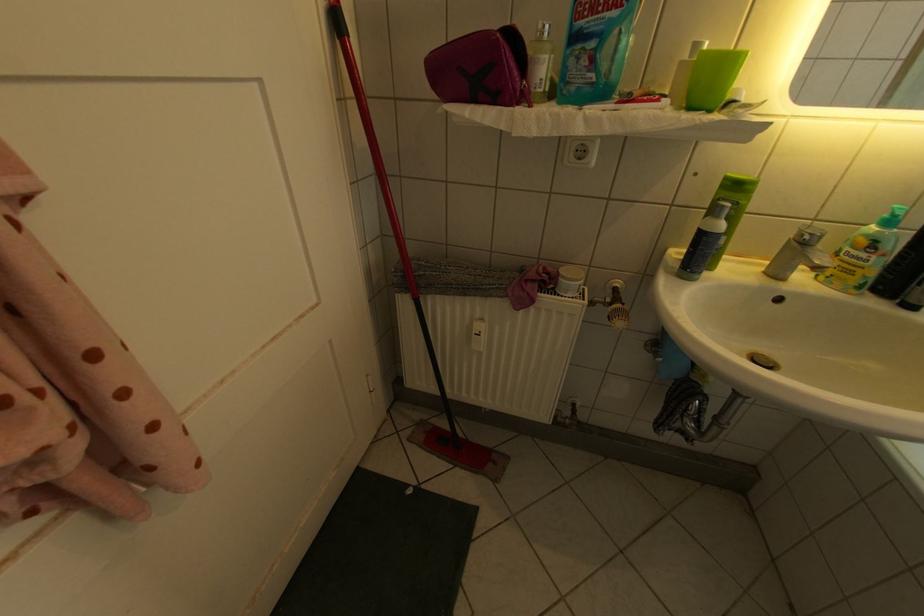
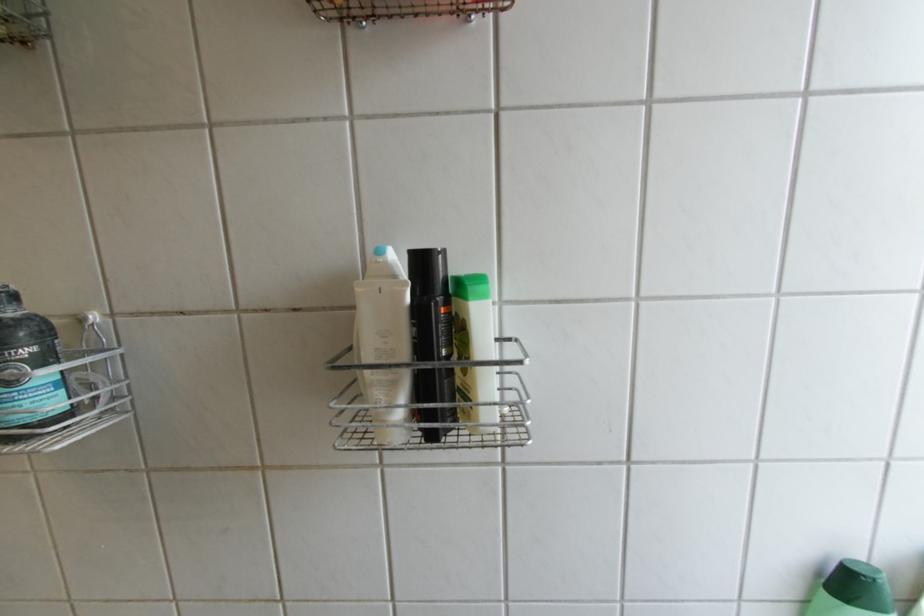
Question: Which direction would the cameraman need to move to produce the second image? Reply with the corresponding letter.

Choices:
 (A) Left
 (B) Right
 (C) Forward
 (D) Backward

Answer: (B)